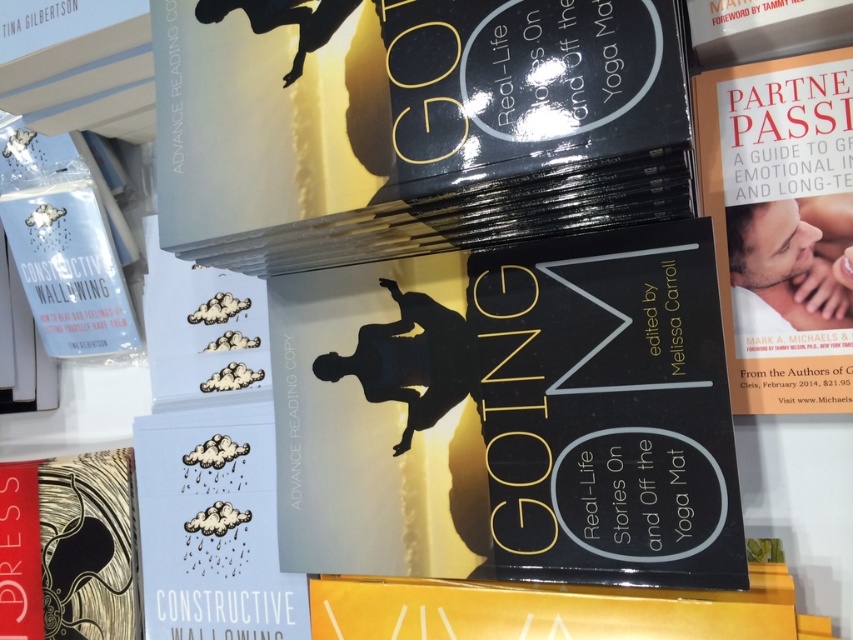
Does matte black book at center have a lesser width compared to orange paper book at right?

No, matte black book at center is not thinner than orange paper book at right.

Does matte black book at center have a larger size compared to orange paper book at right?

Yes, matte black book at center is bigger than orange paper book at right.

What do you see at coordinates (606, 410) in the screenshot? I see `matte black book at center` at bounding box center [606, 410].

The width and height of the screenshot is (853, 640). Identify the location of matte black book at center. (606, 410).